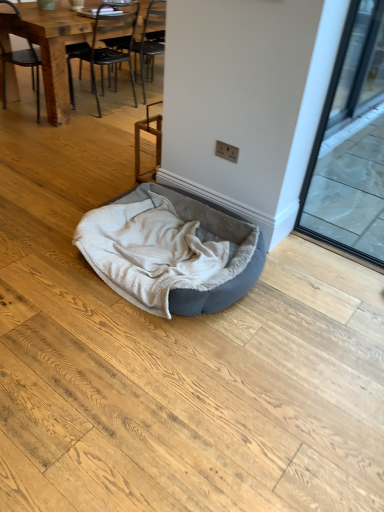
Question: Can you confirm if transparent glass screen door at right is positioned to the left of black metal chair at upper left, the first chair in the right-to-left sequence?

Choices:
 (A) no
 (B) yes

Answer: (A)

Question: Does transparent glass screen door at right have a greater width compared to black metal chair at upper left, the second chair in the left-to-right sequence?

Choices:
 (A) no
 (B) yes

Answer: (A)

Question: Is transparent glass screen door at right not within black metal chair at upper left, the first chair in the right-to-left sequence?

Choices:
 (A) yes
 (B) no

Answer: (A)

Question: Is there a large distance between transparent glass screen door at right and black metal chair at upper left, the second chair in the left-to-right sequence?

Choices:
 (A) no
 (B) yes

Answer: (B)

Question: Does transparent glass screen door at right have a lesser width compared to black metal chair at upper left, the first chair in the right-to-left sequence?

Choices:
 (A) no
 (B) yes

Answer: (B)

Question: Is transparent glass screen door at right positioned in front of black metal chair at upper left, the second chair in the left-to-right sequence?

Choices:
 (A) no
 (B) yes

Answer: (B)

Question: From the image's perspective, is velvet grey dog bed at center located beneath transparent glass screen door at right?

Choices:
 (A) no
 (B) yes

Answer: (B)

Question: Is velvet grey dog bed at center taller than transparent glass screen door at right?

Choices:
 (A) yes
 (B) no

Answer: (B)

Question: Is velvet grey dog bed at center further to camera compared to transparent glass screen door at right?

Choices:
 (A) yes
 (B) no

Answer: (A)

Question: Does velvet grey dog bed at center have a lesser height compared to transparent glass screen door at right?

Choices:
 (A) yes
 (B) no

Answer: (A)

Question: Would you say velvet grey dog bed at center is outside transparent glass screen door at right?

Choices:
 (A) yes
 (B) no

Answer: (A)

Question: Considering the relative sizes of velvet grey dog bed at center and transparent glass screen door at right in the image provided, is velvet grey dog bed at center bigger than transparent glass screen door at right?

Choices:
 (A) no
 (B) yes

Answer: (B)

Question: Can you confirm if black metal chair at upper left, the second chair in the left-to-right sequence, is positioned to the right of wooden chair at left, acting as the 2th chair starting from the right?

Choices:
 (A) yes
 (B) no

Answer: (A)